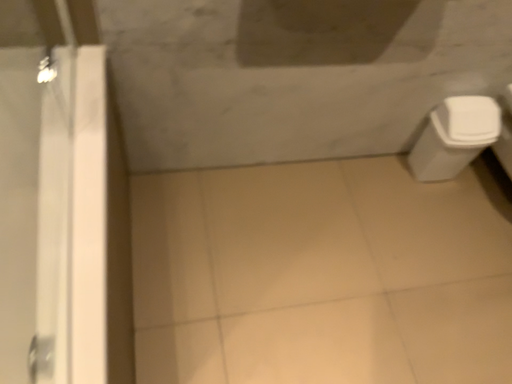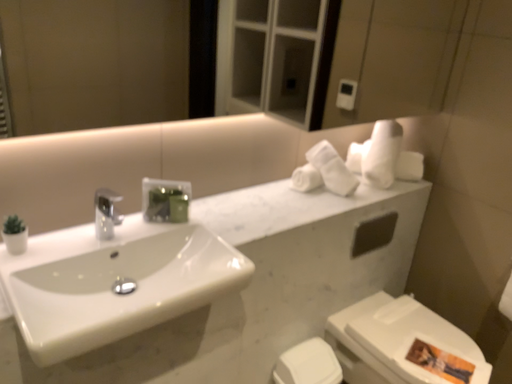
Question: Which way did the camera rotate in the video?

Choices:
 (A) rotated right
 (B) rotated left

Answer: (A)